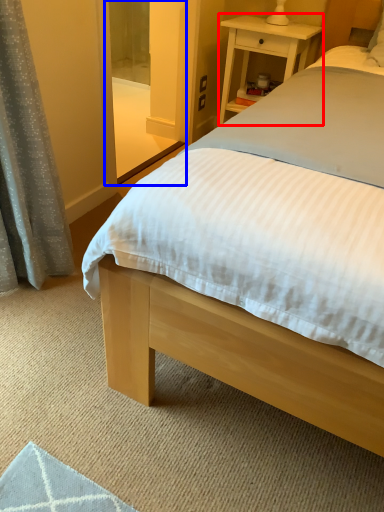
Question: Which of the following is the closest to the observer, nightstand (highlighted by a red box) or screen door (highlighted by a blue box)?

Choices:
 (A) nightstand
 (B) screen door

Answer: (B)